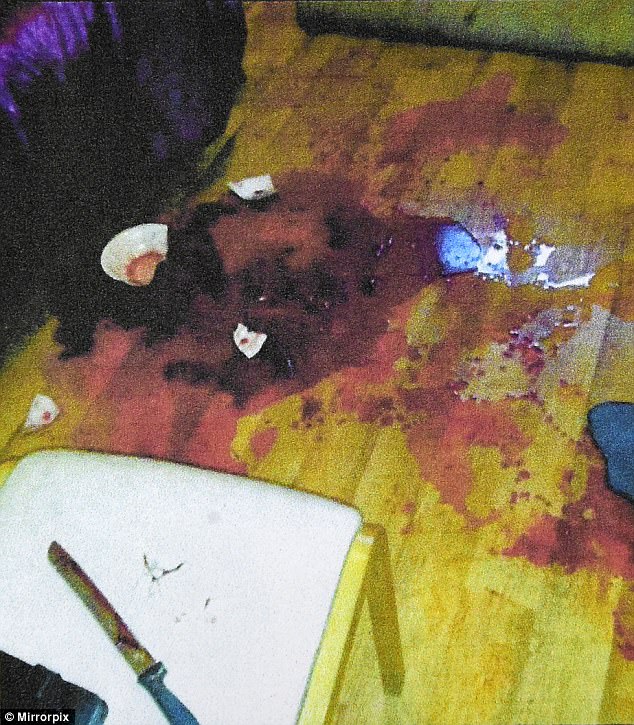
Image resolution: width=634 pixels, height=725 pixels. Identify the location of chair leg. click(x=380, y=618).